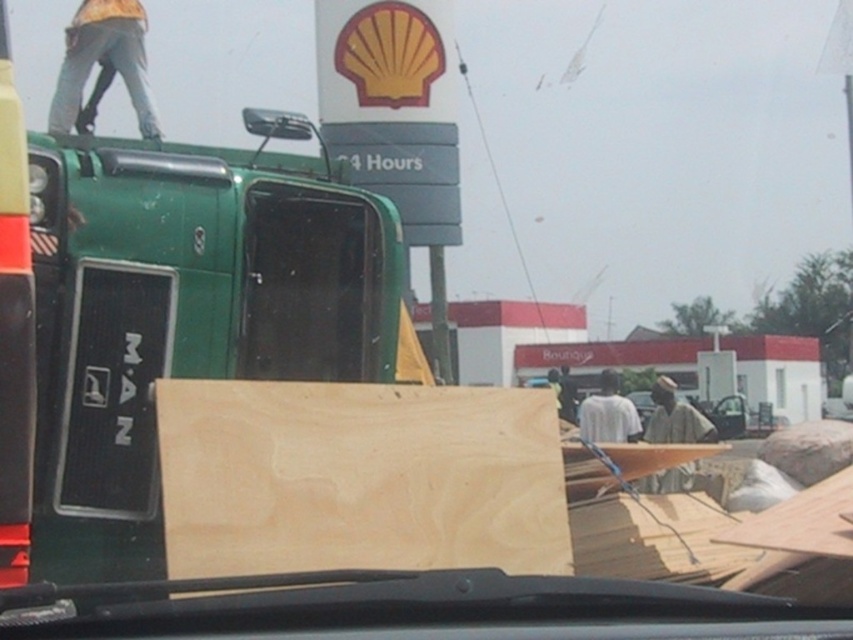
You are driving a car and need to check if you can see the matte green truck at left through the transparent glass windshield at center. Can you see it?

The transparent glass windshield at center is bigger than the matte green truck at left, so yes, you can see the matte green truck at left through the transparent glass windshield at center.

You are a delivery driver approaching the Shell gas station. You need to determine the safest path to park your vehicle without obstructing the transparent glass windshield at center and the matte green truck at left. Based on their positions, which object is closer to you, and should you adjust your parking angle accordingly?

The transparent glass windshield at center is closer to you than the matte green truck at left. To avoid obstructing it, you should adjust your parking angle so that you don not block the transparent glass windshield at center which is in front.